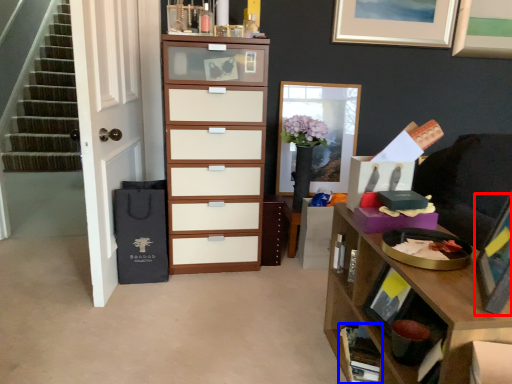
Question: Which point is further to the camera, picture frame (highlighted by a red box) or cabinet (highlighted by a blue box)?

Choices:
 (A) picture frame
 (B) cabinet

Answer: (B)